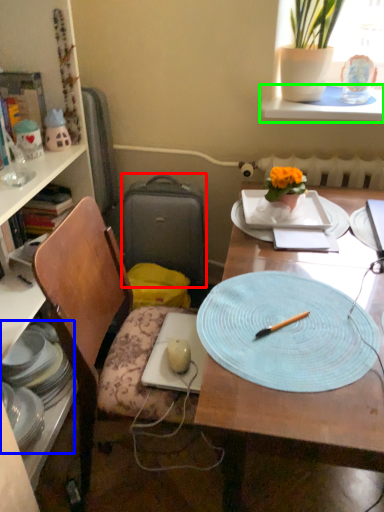
Question: Considering the real-world distances, which object is closest to luggage (highlighted by a red box)? tableware (highlighted by a blue box) or window sill (highlighted by a green box).

Choices:
 (A) tableware
 (B) window sill

Answer: (A)